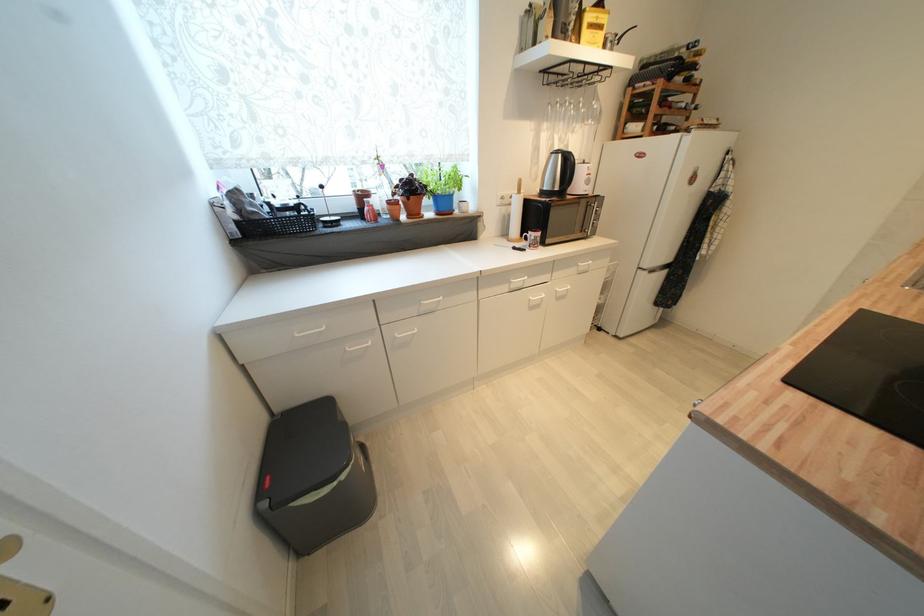
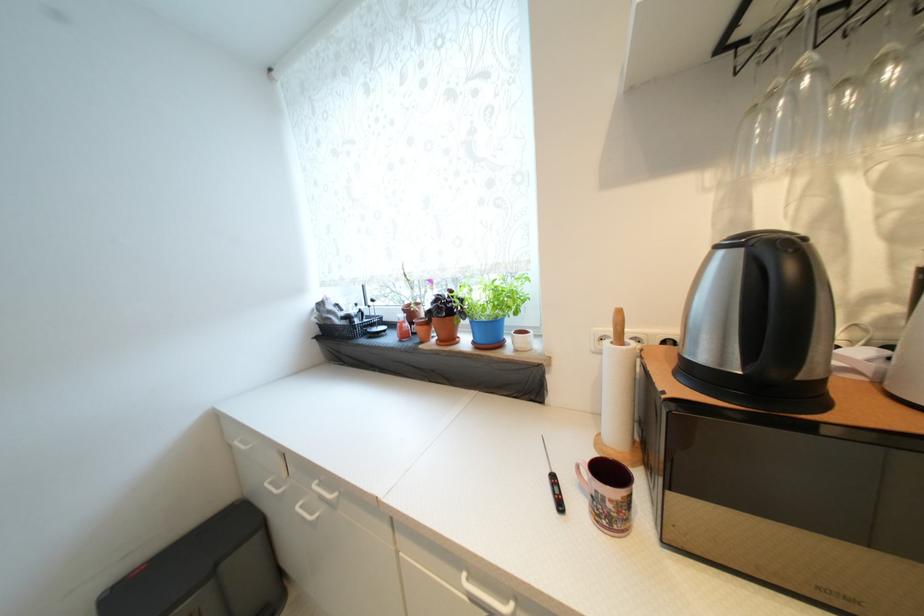
The point at (415, 219) is marked in the first image. Where is the corresponding point in the second image?

(445, 342)